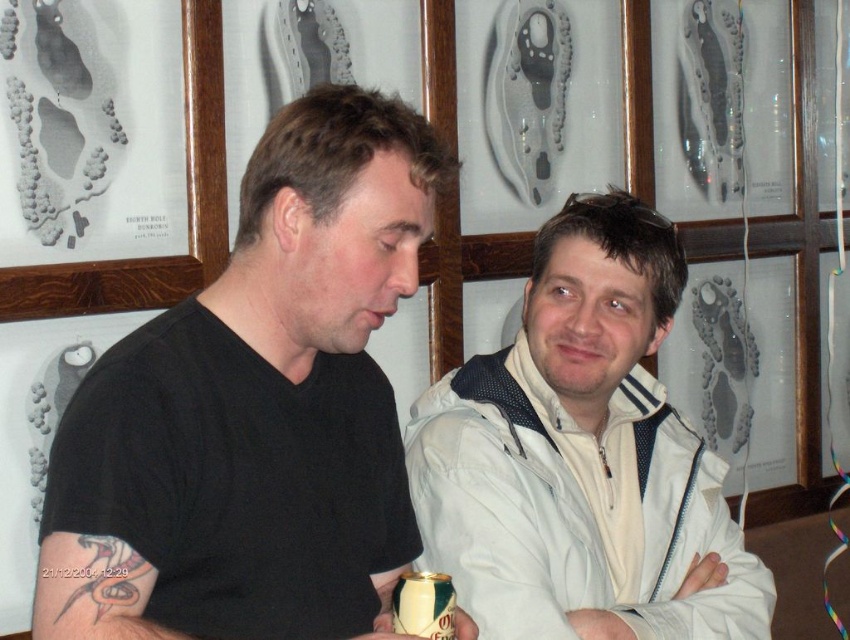
You are a photographer trying to capture a closeup of the green matte can at lower center without including the black matte shirt at center in the frame. Is this possible given their positions?

The black matte shirt at center is located above the green matte can at lower center, so it might be challenging to capture the can without including the shirt in the frame unless you angle the camera downward significantly.

You are a photographer setting up a shoot in this room. You need to ensure that the black matte shirt at center and the white matte jacket at center are both visible in the frame. Given their heights, which one might require you to adjust your camera angle to avoid being cut off?

The white matte jacket at center is taller than the black matte shirt at center, so you might need to adjust the camera angle to ensure the taller white matte jacket at center is fully visible without being cut off.

You are a photographer trying to capture a shot of the green matte can at lower center without the white matte jacket at center blocking it. Based on their positions, is this possible?

The white matte jacket at center is to the right of the green matte can at lower center, so if you move to the left side of the green matte can at lower center, you can avoid the white matte jacket at center and take the shot.